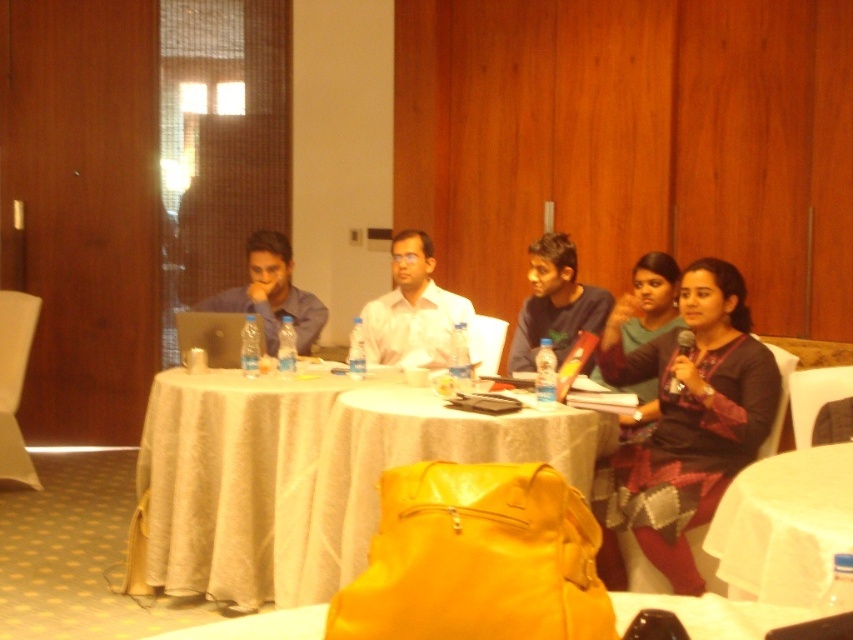
You are sitting at the round table in the conference room and want to pass a document to the person wearing the white glossy shirt at center without disturbing the person in the matte blue shirt at left. How should you pass the document?

You can pass the document to the white glossy shirt at center by moving it along the table to the right side of the matte blue shirt at left, since the white glossy shirt at center is positioned to the right of the matte blue shirt at left.

You are standing in the conference room and want to place a small plant between the two points labeled as point (x=637, y=362) and point (x=550, y=337). Since the plant needs to be placed exactly halfway between them, will it be closer to the viewer or farther away from you?

The point halfway between point (x=637, y=362) and point (x=550, y=337) would be closer to the viewer because point (x=637, y=362) is closer to the viewer than point (x=550, y=337).